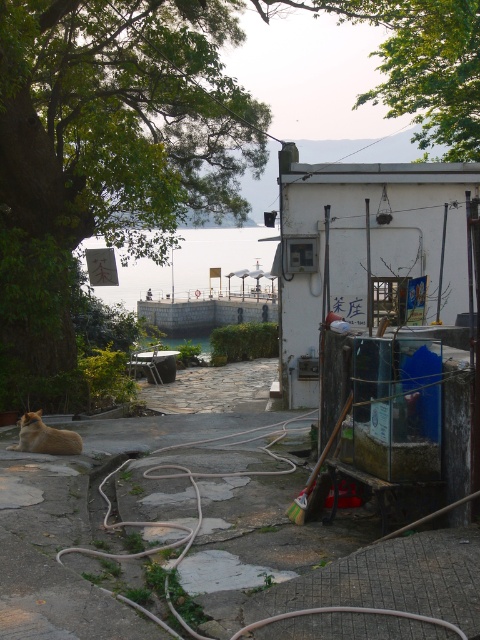
From the picture: You are standing at the entrance of the white building on the right side of the image. Which direction should you look to see the green leafy tree marked by point (106, 154)?

The point (106, 154) marks the green leafy tree at upper left, so you should look to your left to see it.

You are standing at the entrance of the white building on the right side of the image. Looking towards the green leafy tree at upper left located at point (106, 154), can you see the water beyond it?

The green leafy tree at upper left partially obscures the view of the water beyond, so only a portion of the water might be visible through the branches.